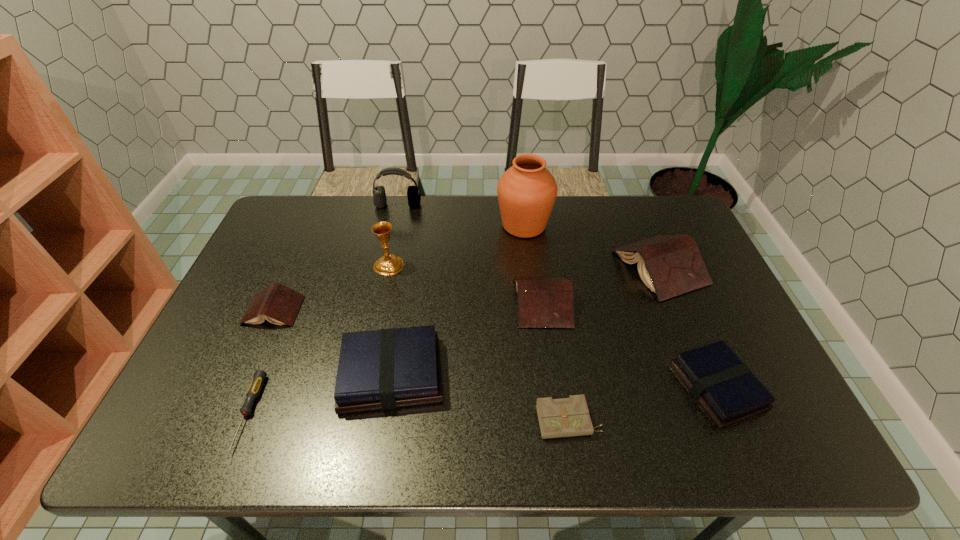
This screenshot has height=540, width=960. I want to click on brown urn, so click(x=527, y=191).

Where is `urn`? urn is located at coordinates (527, 191).

Where is `black headset`? The height and width of the screenshot is (540, 960). black headset is located at coordinates (379, 199).

Identify the location of gold chalice. (390, 264).

Where is `the rightmost brown book`? the rightmost brown book is located at coordinates (670, 265).

The width and height of the screenshot is (960, 540). In order to click on the tallest book in this screenshot , I will do `click(670, 265)`.

What are the coordinates of `the second smallest brown book` in the screenshot? It's located at (543, 302).

Identify the location of the third book from right to left. The height and width of the screenshot is (540, 960). (543, 302).

At what (x,y) coordinates should I click in order to perform the action: click on the bigger blue book. Please return your answer as a coordinate pair (x, y). This screenshot has width=960, height=540. Looking at the image, I should click on pos(383,369).

Locate an element on the screen. The image size is (960, 540). the left blue book is located at coordinates (383, 369).